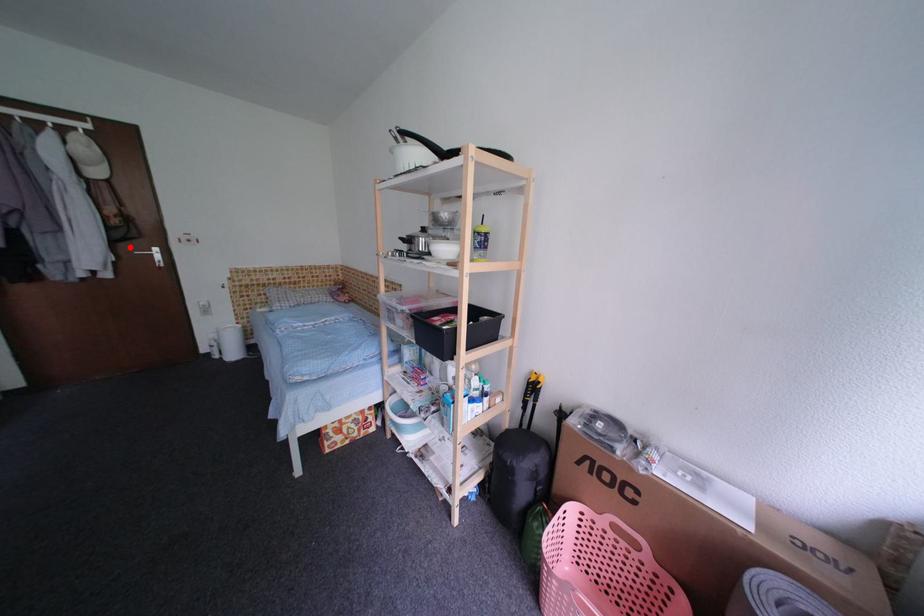
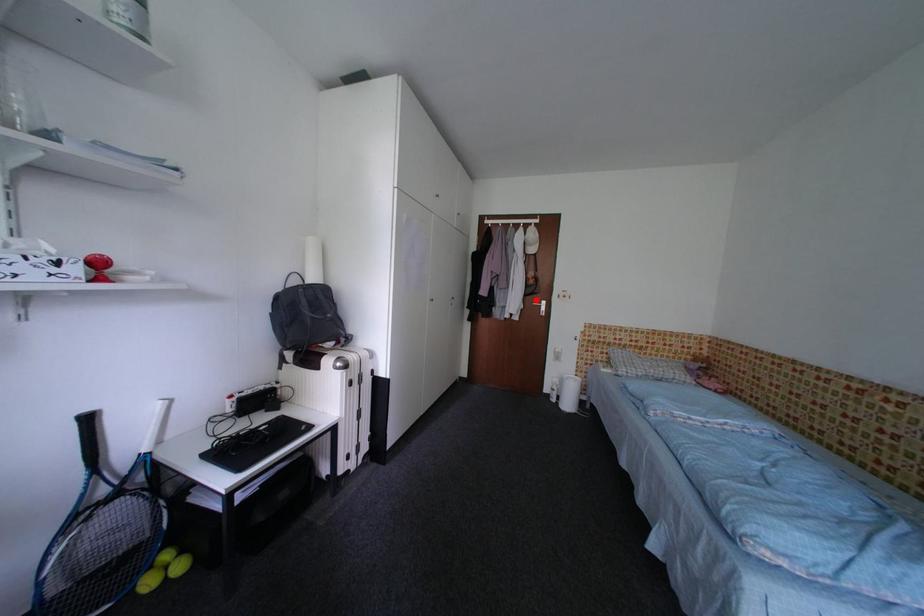
I am providing you with two images of the same scene from different viewpoints. A red point is marked on the first image and another point is marked on the second image. Is the marked point in image1 the same physical position as the marked point in image2?

Yes